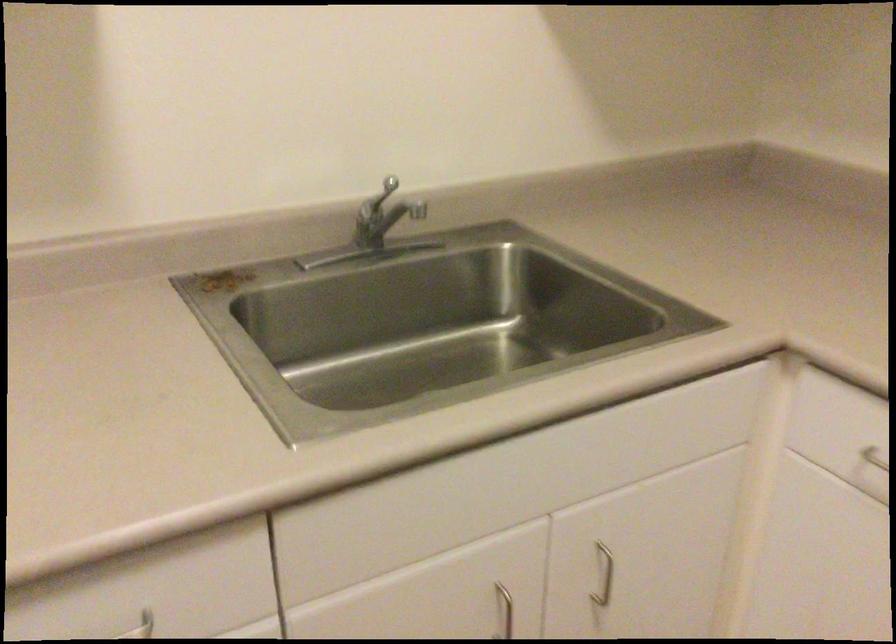
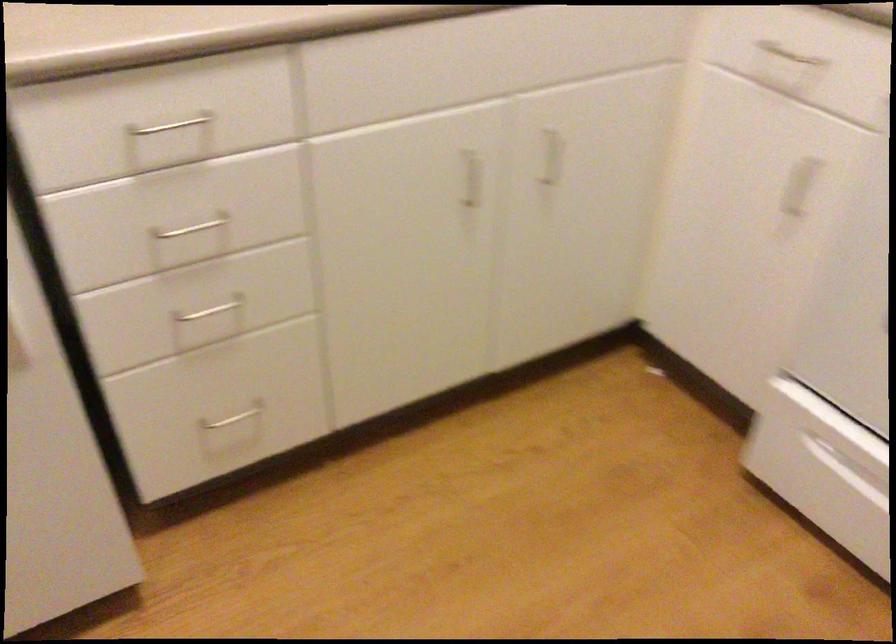
The point at (606, 565) is marked in the first image. Where is the corresponding point in the second image?

(552, 156)